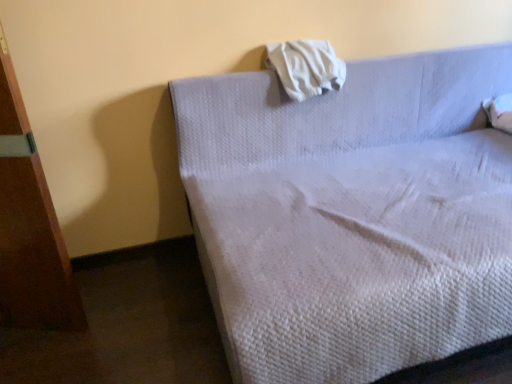
This screenshot has width=512, height=384. What do you see at coordinates (353, 214) in the screenshot?
I see `white quilted fabric bed at upper center` at bounding box center [353, 214].

Identify the location of white quilted fabric bed at upper center. Image resolution: width=512 pixels, height=384 pixels. (353, 214).

The image size is (512, 384). What do you see at coordinates (305, 67) in the screenshot?
I see `white soft cloth at upper center` at bounding box center [305, 67].

Locate an element on the screen. white soft cloth at upper center is located at coordinates (305, 67).

Locate an element on the screen. white quilted fabric bed at upper center is located at coordinates (353, 214).

Considering the positions of objects white quilted fabric bed at upper center and white soft cloth at upper center in the image provided, who is more to the right, white quilted fabric bed at upper center or white soft cloth at upper center?

From the viewer's perspective, white quilted fabric bed at upper center appears more on the right side.

Is white quilted fabric bed at upper center in front of or behind white soft cloth at upper center in the image?

Clearly, white quilted fabric bed at upper center is in front of white soft cloth at upper center.

Considering the positions of points (206, 213) and (297, 77), is point (206, 213) farther from camera compared to point (297, 77)?

That is False.

From the image's perspective, is white quilted fabric bed at upper center located above white soft cloth at upper center?

Incorrect, from the image's perspective, white quilted fabric bed at upper center is lower than white soft cloth at upper center.

From a real-world perspective, is white quilted fabric bed at upper center positioned above or below white soft cloth at upper center?

white quilted fabric bed at upper center is below white soft cloth at upper center.

Does white quilted fabric bed at upper center have a lesser width compared to white soft cloth at upper center?

No, white quilted fabric bed at upper center is not thinner than white soft cloth at upper center.

Can you confirm if white quilted fabric bed at upper center is taller than white soft cloth at upper center?

Yes, white quilted fabric bed at upper center is taller than white soft cloth at upper center.

Which of these two, white quilted fabric bed at upper center or white soft cloth at upper center, is smaller?

white soft cloth at upper center.

Is white quilted fabric bed at upper center situated inside white soft cloth at upper center or outside?

white quilted fabric bed at upper center is outside white soft cloth at upper center.

Is there a large distance between white quilted fabric bed at upper center and white soft cloth at upper center?

No.

Is white quilted fabric bed at upper center positioned with its back to white soft cloth at upper center?

Absolutely, white quilted fabric bed at upper center is directed away from white soft cloth at upper center.

How many degrees apart are the facing directions of white quilted fabric bed at upper center and white soft cloth at upper center?

0.776 degrees.

In the scene shown: Measure the distance between white quilted fabric bed at upper center and white soft cloth at upper center.

They are 15.22 inches apart.

In the image, there is a white soft cloth at upper center. At what (x,y) coordinates should I click in order to perform the action: click on bed below it (from the image's perspective). Please return your answer as a coordinate pair (x, y). The image size is (512, 384). Looking at the image, I should click on (353, 214).

Visually, is white soft cloth at upper center positioned to the left or to the right of white quilted fabric bed at upper center?

From the image, it's evident that white soft cloth at upper center is to the left of white quilted fabric bed at upper center.

Considering the positions of objects white soft cloth at upper center and white quilted fabric bed at upper center in the image provided, who is in front, white soft cloth at upper center or white quilted fabric bed at upper center?

Positioned in front is white quilted fabric bed at upper center.

Which is in front, point (322, 53) or point (489, 212)?

Point (489, 212)

From the image's perspective, who appears lower, white soft cloth at upper center or white quilted fabric bed at upper center?

white quilted fabric bed at upper center appears lower in the image.

Looking at this image, from a real-world perspective, is white soft cloth at upper center physically located above or below white quilted fabric bed at upper center?

white soft cloth at upper center is situated higher than white quilted fabric bed at upper center in the real world.

Which object is thinner, white soft cloth at upper center or white quilted fabric bed at upper center?

white soft cloth at upper center.

Between white soft cloth at upper center and white quilted fabric bed at upper center, which one has less height?

white soft cloth at upper center.

Who is bigger, white soft cloth at upper center or white quilted fabric bed at upper center?

white quilted fabric bed at upper center is bigger.

Is white soft cloth at upper center situated inside white quilted fabric bed at upper center or outside?

white soft cloth at upper center is located inside white quilted fabric bed at upper center.

Can you see white soft cloth at upper center touching white quilted fabric bed at upper center?

white soft cloth at upper center and white quilted fabric bed at upper center are not in contact.

Is white soft cloth at upper center positioned with its back to white quilted fabric bed at upper center?

Yes, white soft cloth at upper center is positioned with its back facing white quilted fabric bed at upper center.

How much distance is there between white soft cloth at upper center and white quilted fabric bed at upper center?

15.22 inches.

The height and width of the screenshot is (384, 512). Find the location of `cloth that is above the white quilted fabric bed at upper center (from a real-world perspective)`. cloth that is above the white quilted fabric bed at upper center (from a real-world perspective) is located at coordinates (305, 67).

Locate an element on the screen. bed below the white soft cloth at upper center (from the image's perspective) is located at coordinates [353, 214].

The image size is (512, 384). What are the coordinates of `cloth located above the white quilted fabric bed at upper center (from the image's perspective)` in the screenshot? It's located at (305, 67).